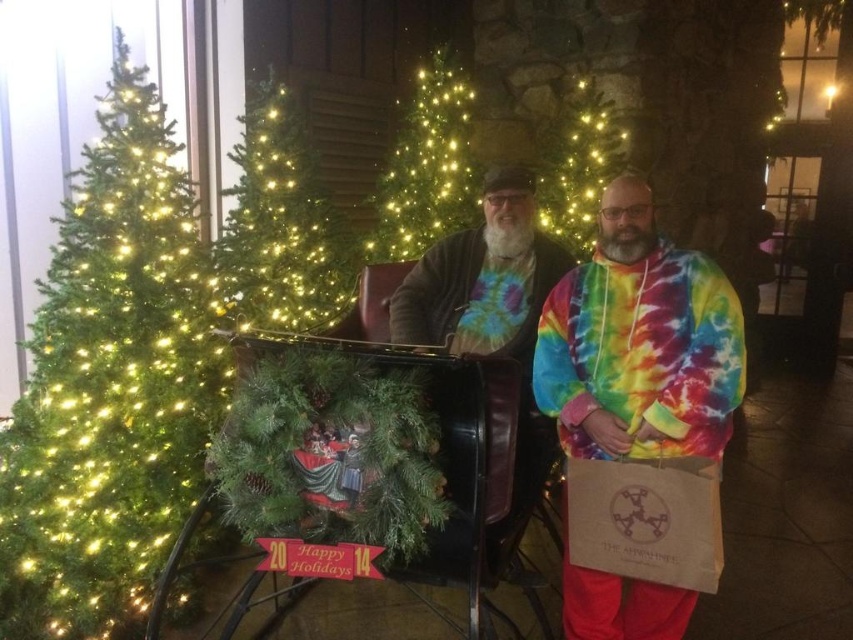
You are standing in the festive holiday scene and want to take a photo of the green matte christmas tree at upper left. If your camera has a maximum focus range of 3 meters, will it be able to capture the tree clearly?

The green matte christmas tree at upper left is 2.93 meters away from the viewer. Since the camera can focus up to 3 meters, it will be able to capture the tree clearly within the focus range.

You are at the festive holiday scene and want to place a gift into the brown paper bag at lower right. Can you do so without moving the green artificial christmas tree at left?

The green artificial christmas tree at left is positioned over brown paper bag at lower right, so you cannot place the gift into the brown paper bag at lower right without moving the green artificial christmas tree at left.